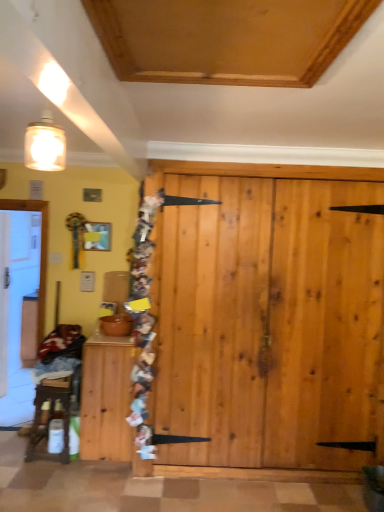
Based on the photo, what is the approximate width of wooden cabinet at lower left?

wooden cabinet at lower left is 22.53 inches in width.

Image resolution: width=384 pixels, height=512 pixels. What do you see at coordinates (106, 398) in the screenshot?
I see `wooden cabinet at lower left` at bounding box center [106, 398].

I want to click on wooden cabinet at lower left, so click(106, 398).

What do you see at coordinates (50, 413) in the screenshot? Image resolution: width=384 pixels, height=512 pixels. I see `wooden table at left` at bounding box center [50, 413].

Locate an element on the screen. wooden table at left is located at coordinates (50, 413).

The image size is (384, 512). In order to click on wooden cabinet at lower left in this screenshot , I will do `click(106, 398)`.

Is wooden table at left to the left of wooden cabinet at lower left from the viewer's perspective?

Indeed, wooden table at left is positioned on the left side of wooden cabinet at lower left.

Does wooden table at left lie behind wooden cabinet at lower left?

That is True.

Is point (59, 379) closer or farther from the camera than point (88, 374)?

Point (59, 379) appears to be farther away from the viewer than point (88, 374).

From the image's perspective, would you say wooden table at left is positioned over wooden cabinet at lower left?

No, from the image's perspective, wooden table at left is not above wooden cabinet at lower left.

From a real-world perspective, which object rests below the other?

wooden table at left.

Does wooden table at left have a greater width compared to wooden cabinet at lower left?

No, wooden table at left is not wider than wooden cabinet at lower left.

Can you confirm if wooden table at left is taller than wooden cabinet at lower left?

Incorrect, the height of wooden table at left is not larger of that of wooden cabinet at lower left.

Considering the relative sizes of wooden table at left and wooden cabinet at lower left in the image provided, is wooden table at left smaller than wooden cabinet at lower left?

Yes, wooden table at left is smaller than wooden cabinet at lower left.

Is wooden table at left not inside wooden cabinet at lower left?

Yes, wooden table at left is located beyond the bounds of wooden cabinet at lower left.

In the scene shown: Is wooden table at left not near wooden cabinet at lower left?

No, wooden table at left is not far away from wooden cabinet at lower left.

Is wooden table at left oriented away from wooden cabinet at lower left?

No, wooden cabinet at lower left is not at the back of wooden table at left.

Where is `furniture on the left of wooden cabinet at lower left`? The width and height of the screenshot is (384, 512). furniture on the left of wooden cabinet at lower left is located at coordinates (50, 413).

In the image, is wooden cabinet at lower left on the left side or the right side of wooden table at left?

From the image, it's evident that wooden cabinet at lower left is to the right of wooden table at left.

Does wooden cabinet at lower left lie in front of wooden table at left?

Yes, it is in front of wooden table at left.

Which is closer to the camera, (106, 380) or (52, 396)?

Point (106, 380).

In the scene shown: From the image's perspective, is wooden cabinet at lower left above wooden table at left?

Yes, from the image's perspective, wooden cabinet at lower left is on top of wooden table at left.

From a real-world perspective, which object stands above the other?

In real-world perspective, wooden cabinet at lower left is above.

Which of these two, wooden cabinet at lower left or wooden table at left, is wider?

wooden cabinet at lower left is wider.

From the picture: Does wooden cabinet at lower left have a lesser height compared to wooden table at left?

Incorrect, the height of wooden cabinet at lower left does not fall short of that of wooden table at left.

Between wooden cabinet at lower left and wooden table at left, which one has larger size?

With larger size is wooden cabinet at lower left.

In the scene shown: Is wooden cabinet at lower left outside of wooden table at left?

Yes, wooden cabinet at lower left is outside of wooden table at left.

Is there a large distance between wooden cabinet at lower left and wooden table at left?

wooden cabinet at lower left is near wooden table at left, not far away.

Is wooden cabinet at lower left turned away from wooden table at left?

wooden cabinet at lower left does not have its back to wooden table at left.

How many degrees apart are the facing directions of wooden cabinet at lower left and wooden table at left?

The angle between the facing direction of wooden cabinet at lower left and the facing direction of wooden table at left is 0.00117 degrees.

The image size is (384, 512). Identify the location of furniture behind the wooden cabinet at lower left. tap(50, 413).

In order to click on furniture that is below the wooden cabinet at lower left (from the image's perspective) in this screenshot , I will do `click(50, 413)`.

This screenshot has height=512, width=384. I want to click on cabinetry that is above the wooden table at left (from the image's perspective), so click(x=106, y=398).